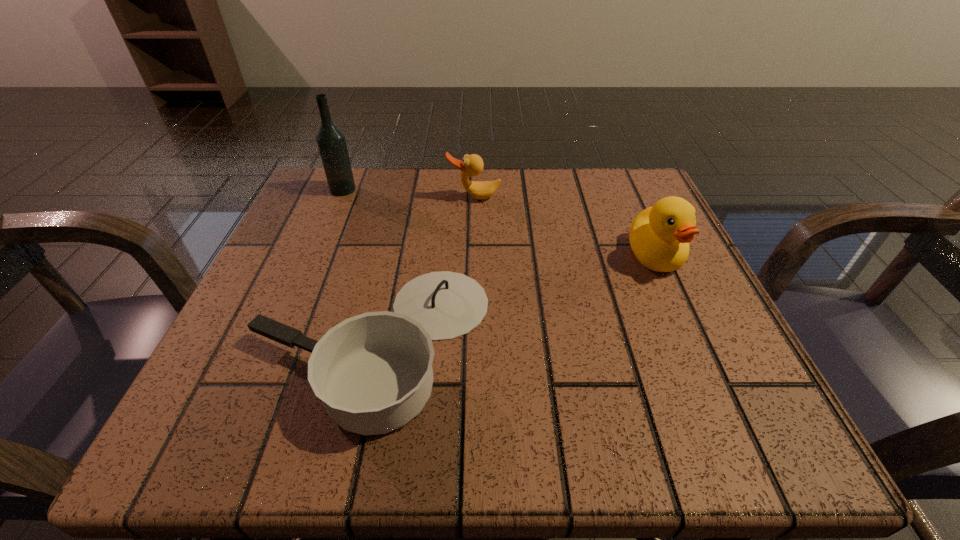
Locate an element on the screen. This screenshot has height=540, width=960. the tallest object is located at coordinates (331, 141).

You are a GUI agent. You are given a task and a screenshot of the screen. Output one action in this format:
    pyautogui.click(x=<x>, y=<y>)
    Task: Click on the rightmost object
    The width and height of the screenshot is (960, 540).
    Given the screenshot: What is the action you would take?
    pyautogui.click(x=659, y=236)

I want to click on the second tallest object, so click(659, 236).

At what (x,y) coordinates should I click in order to perform the action: click on the left duck. Please return your answer as a coordinate pair (x, y). Looking at the image, I should click on (472, 165).

Where is `the farther duck`? the farther duck is located at coordinates (472, 165).

The height and width of the screenshot is (540, 960). Find the location of `saucepan`. saucepan is located at coordinates pos(373,372).

Locate an element on the screen. This screenshot has height=540, width=960. blank space located 0.160m on the right of the vodka is located at coordinates (429, 190).

Where is `free location located 0.200m at the beak of the taller duck`? This screenshot has width=960, height=540. free location located 0.200m at the beak of the taller duck is located at coordinates (711, 383).

Identify the location of free space located 0.230m on the beak of the left duck. This screenshot has height=540, width=960. (472, 279).

Image resolution: width=960 pixels, height=540 pixels. What are the coordinates of `vacant space located on the right of the saucepan` in the screenshot? It's located at (590, 342).